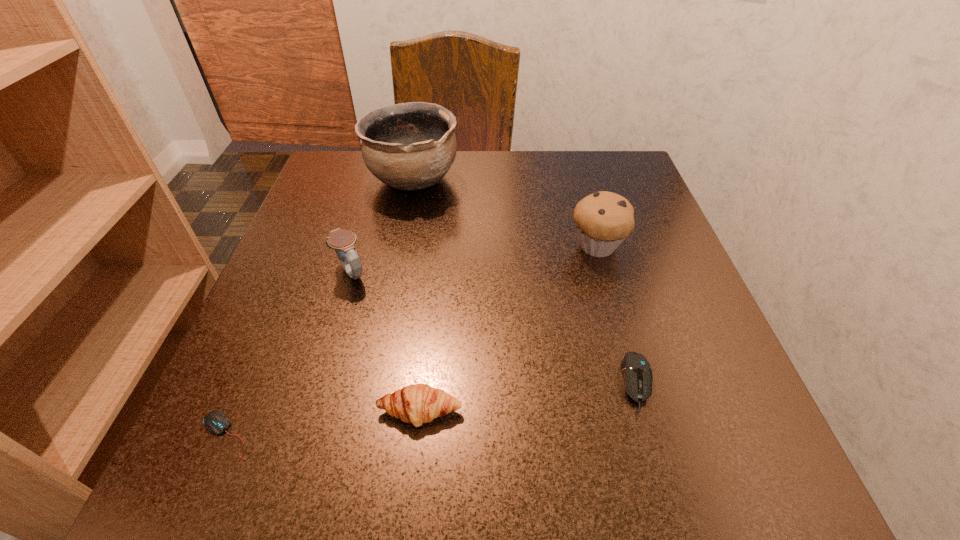
Where is `pottery`? Image resolution: width=960 pixels, height=540 pixels. pottery is located at coordinates (411, 146).

The width and height of the screenshot is (960, 540). Find the location of `the farthest object`. the farthest object is located at coordinates (411, 146).

Identify the location of the fifth shortest object. (603, 219).

Where is `the fourth shortest object`? the fourth shortest object is located at coordinates (342, 241).

Locate an element on the screen. the third shortest object is located at coordinates (418, 403).

You are a GUI agent. You are given a task and a screenshot of the screen. Output one action in this format:
    pyautogui.click(x=<x>, y=<y>)
    Task: Click on the second shortest object
    
    Given the screenshot: What is the action you would take?
    pyautogui.click(x=636, y=370)

This screenshot has height=540, width=960. What are the coordinates of `the right mouse` in the screenshot? It's located at (636, 370).

Find the location of a particular element. the left mouse is located at coordinates (216, 422).

Locate an element on the screen. The image size is (960, 540). the leftmost object is located at coordinates (216, 422).

At what (x,y) coordinates should I click in order to perform the action: click on vacant space located 0.330m on the front of the pottery. Please return your answer as a coordinate pair (x, y). This screenshot has width=960, height=540. Looking at the image, I should click on (384, 328).